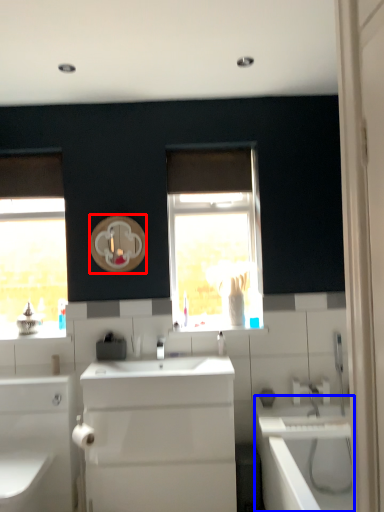
Question: Among these objects, which one is farthest to the camera, mirror (highlighted by a red box) or bath (highlighted by a blue box)?

Choices:
 (A) mirror
 (B) bath

Answer: (A)